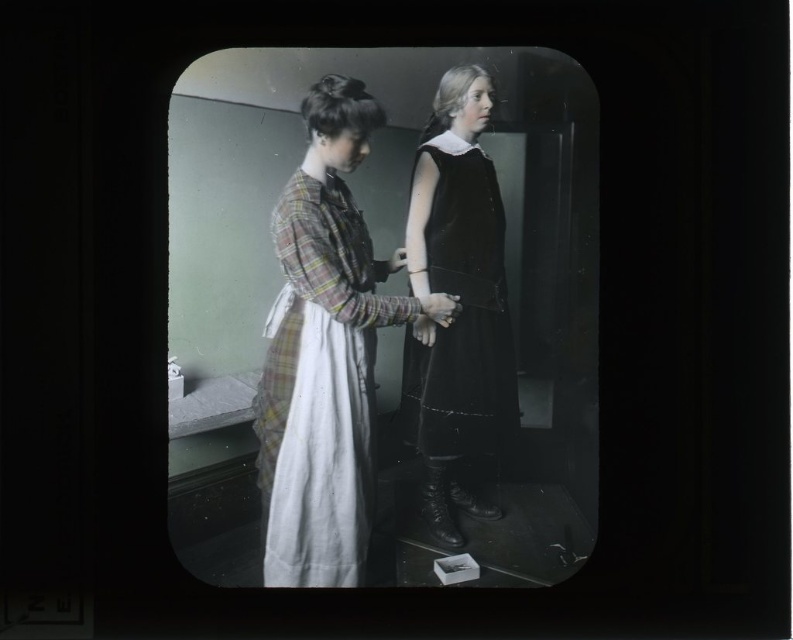
Question: Is plaid fabric dress at center positioned behind smooth white glove at center?

Choices:
 (A) yes
 (B) no

Answer: (B)

Question: Among these objects, which one is nearest to the camera?

Choices:
 (A) plaid fabric dress at center
 (B) smooth white glove at center
 (C) velvet black dress at center

Answer: (A)

Question: Which of these objects is positioned closest to the plaid fabric dress at center?

Choices:
 (A) velvet black dress at center
 (B) smooth white glove at center

Answer: (A)

Question: Is plaid fabric dress at center positioned in front of velvet black dress at center?

Choices:
 (A) yes
 (B) no

Answer: (A)

Question: Which of the following is the closest to the observer?

Choices:
 (A) (514, 419)
 (B) (259, 476)
 (C) (424, 317)

Answer: (B)

Question: Can you confirm if velvet black dress at center is positioned below smooth white glove at center?

Choices:
 (A) yes
 (B) no

Answer: (B)